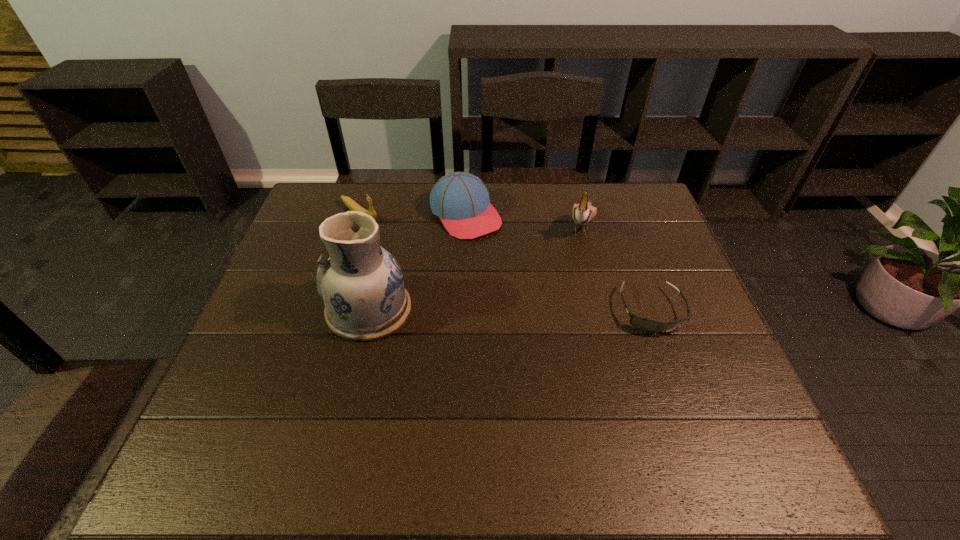
Where is `vacant space that satisfies the following two spatial constraints: 1. on the front side of the bird; 2. on the right side of the third object from left to right`? This screenshot has width=960, height=540. vacant space that satisfies the following two spatial constraints: 1. on the front side of the bird; 2. on the right side of the third object from left to right is located at coordinates (466, 224).